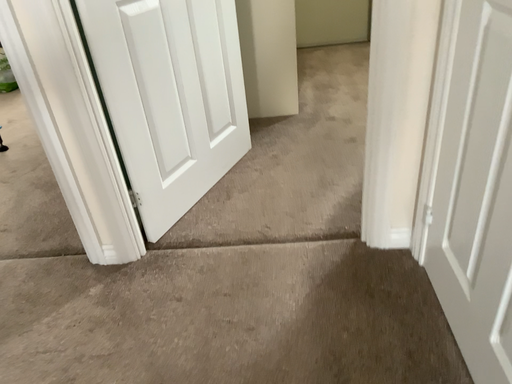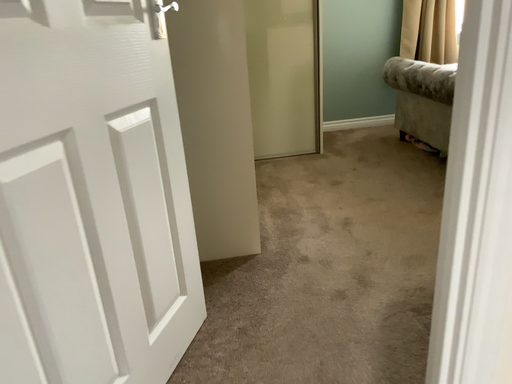
Question: Which way did the camera rotate in the video?

Choices:
 (A) rotated left
 (B) rotated right

Answer: (B)